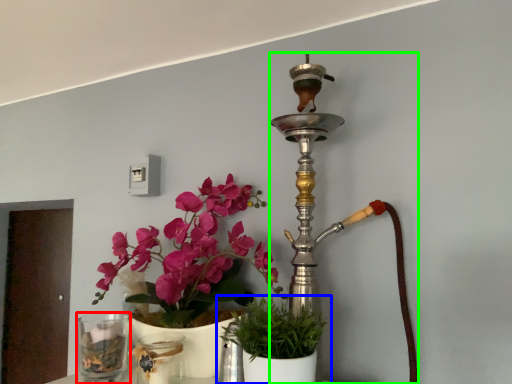
Question: Which is farther away from vase (highlighted by a red box)? houseplant (highlighted by a blue box) or candle holder (highlighted by a green box)?

Choices:
 (A) houseplant
 (B) candle holder

Answer: (B)